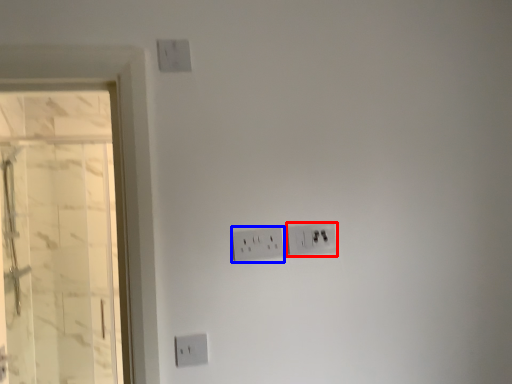
Question: Which object is closer to the camera taking this photo, power plugs and sockets (highlighted by a red box) or power plugs and sockets (highlighted by a blue box)?

Choices:
 (A) power plugs and sockets
 (B) power plugs and sockets

Answer: (B)